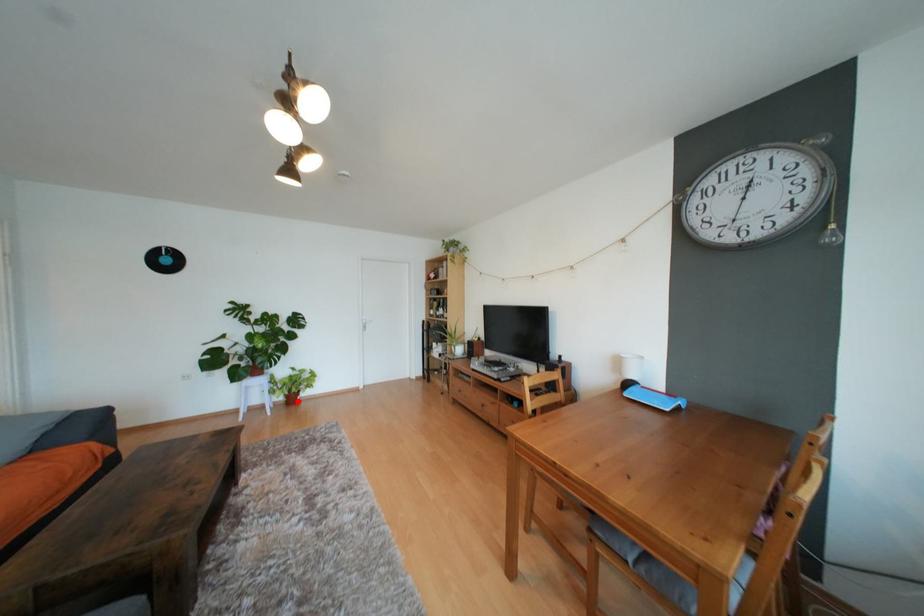
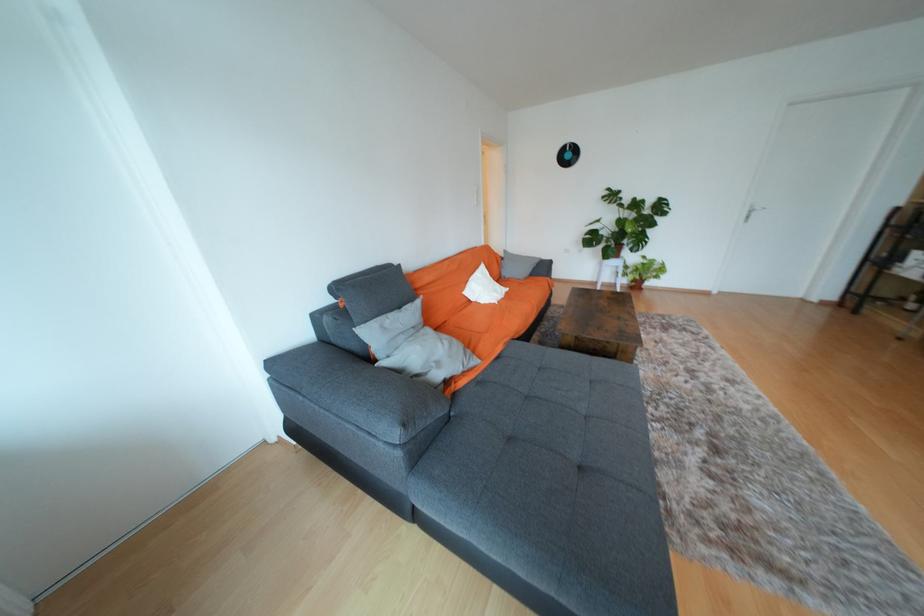
In the second image, find the point that corresponds to the highlighted location in the first image.

(641, 286)